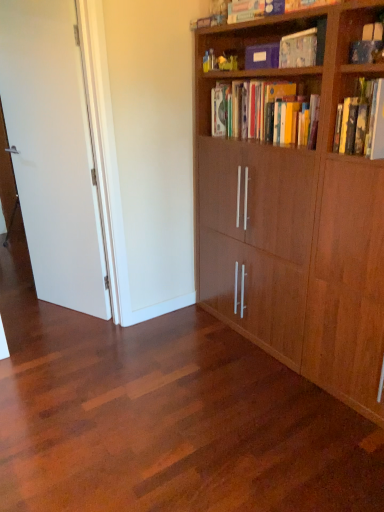
Question: Which direction should I rotate to look at hardcover books at upper center, which is the 1th book in bottom-to-top order?

Choices:
 (A) right
 (B) left

Answer: (A)

Question: Does wooden bookcase at right have a lesser height compared to matte cardboard book at upper center, which appears as the 2th book when ordered from the bottom?

Choices:
 (A) yes
 (B) no

Answer: (B)

Question: Is wooden bookcase at right taller than matte cardboard book at upper center, which is the second book in top-to-bottom order?

Choices:
 (A) yes
 (B) no

Answer: (A)

Question: Is wooden bookcase at right with matte cardboard book at upper center, which appears as the 2th book when ordered from the bottom?

Choices:
 (A) yes
 (B) no

Answer: (B)

Question: Would you say wooden bookcase at right contains matte cardboard book at upper center, which appears as the 2th book when ordered from the bottom?

Choices:
 (A) no
 (B) yes

Answer: (B)

Question: Is wooden bookcase at right thinner than matte cardboard book at upper center, which appears as the 2th book when ordered from the bottom?

Choices:
 (A) no
 (B) yes

Answer: (A)

Question: From a real-world perspective, is wooden bookcase at right physically below matte cardboard book at upper center, which appears as the 2th book when ordered from the bottom?

Choices:
 (A) no
 (B) yes

Answer: (B)

Question: Are matte cardboard book at upper center, which is the second book in top-to-bottom order, and matte blue book at upper center, which ranks as the first book in top-to-bottom order, beside each other?

Choices:
 (A) no
 (B) yes

Answer: (A)

Question: Is matte cardboard book at upper center, which appears as the 2th book when ordered from the bottom, closer to camera compared to matte blue book at upper center, which ranks as the first book in top-to-bottom order?

Choices:
 (A) yes
 (B) no

Answer: (A)

Question: Is matte cardboard book at upper center, which appears as the 2th book when ordered from the bottom, shorter than matte blue book at upper center, arranged as the third book when ordered from the bottom?

Choices:
 (A) no
 (B) yes

Answer: (A)

Question: Is matte cardboard book at upper center, which appears as the 2th book when ordered from the bottom, wider than matte blue book at upper center, arranged as the third book when ordered from the bottom?

Choices:
 (A) no
 (B) yes

Answer: (A)

Question: Is matte cardboard book at upper center, which appears as the 2th book when ordered from the bottom, at the left side of matte blue book at upper center, arranged as the third book when ordered from the bottom?

Choices:
 (A) yes
 (B) no

Answer: (B)

Question: Is matte cardboard book at upper center, which appears as the 2th book when ordered from the bottom, smaller than matte blue book at upper center, which ranks as the first book in top-to-bottom order?

Choices:
 (A) no
 (B) yes

Answer: (B)

Question: Are shiny wood floor at center and white matte door at left far apart?

Choices:
 (A) no
 (B) yes

Answer: (B)